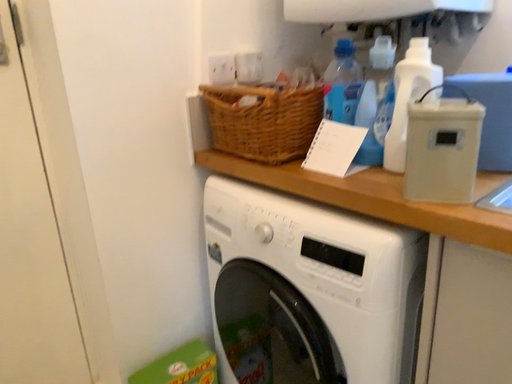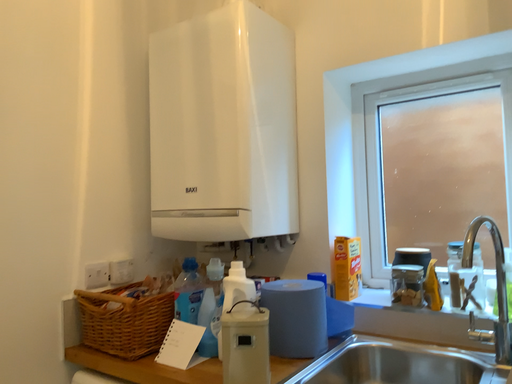
Question: How did the camera likely rotate when shooting the video?

Choices:
 (A) rotated downward
 (B) rotated upward

Answer: (B)